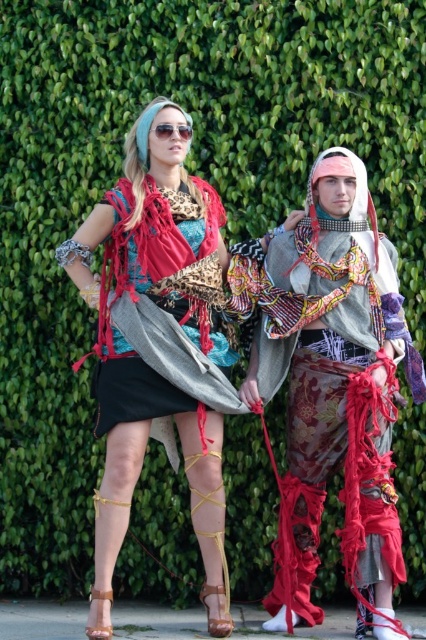
Is leopard print scarf at center to the left of sunglasses at upper center from the viewer's perspective?

Yes, leopard print scarf at center is to the left of sunglasses at upper center.

Who is positioned more to the left, leopard print scarf at center or sunglasses at upper center?

From the viewer's perspective, leopard print scarf at center appears more on the left side.

What do you see at coordinates (158, 346) in the screenshot?
I see `leopard print scarf at center` at bounding box center [158, 346].

This screenshot has height=640, width=426. In order to click on leopard print scarf at center in this screenshot , I will do `click(158, 346)`.

How much distance is there between textured fabric pants at center and leather/textured skirt at center?

76.06 centimeters

From the picture: Who is more distant from viewer, (305, 522) or (175, 192)?

The point (175, 192) is more distant.

Does point (321, 300) come farther from viewer compared to point (152, 394)?

Yes.

Find the location of a particular element. Image resolution: width=426 pixels, height=640 pixels. textured fabric pants at center is located at coordinates (336, 385).

Between leopard print scarf at center and leather/textured skirt at center, which one appears on the right side from the viewer's perspective?

From the viewer's perspective, leather/textured skirt at center appears more on the right side.

Does leopard print scarf at center have a lesser width compared to leather/textured skirt at center?

Incorrect, leopard print scarf at center's width is not less than leather/textured skirt at center's.

Is point (143, 298) farther from camera compared to point (123, 196)?

That is False.

Locate an element on the screen. leopard print scarf at center is located at coordinates (158, 346).